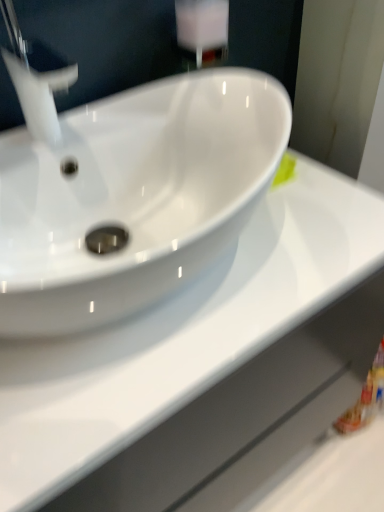
Question: Is white glossy faucet at upper left facing away from white glossy counter top at center?

Choices:
 (A) yes
 (B) no

Answer: (B)

Question: Is the position of white glossy faucet at upper left more distant than that of white glossy counter top at center?

Choices:
 (A) no
 (B) yes

Answer: (B)

Question: Does white glossy faucet at upper left appear on the left side of white glossy counter top at center?

Choices:
 (A) yes
 (B) no

Answer: (A)

Question: Is white glossy faucet at upper left oriented towards white glossy counter top at center?

Choices:
 (A) yes
 (B) no

Answer: (B)

Question: Is white glossy faucet at upper left positioned in front of white glossy counter top at center?

Choices:
 (A) yes
 (B) no

Answer: (B)

Question: Is white glossy faucet at upper left positioned far away from white glossy counter top at center?

Choices:
 (A) yes
 (B) no

Answer: (B)

Question: Considering the relative positions of white glossy counter top at center and white glossy faucet at upper left in the image provided, is white glossy counter top at center behind white glossy faucet at upper left?

Choices:
 (A) no
 (B) yes

Answer: (A)

Question: Is white glossy counter top at center oriented towards white glossy faucet at upper left?

Choices:
 (A) yes
 (B) no

Answer: (B)

Question: Is white glossy counter top at center at the right side of white glossy faucet at upper left?

Choices:
 (A) yes
 (B) no

Answer: (A)

Question: Is white glossy counter top at center wider than white glossy faucet at upper left?

Choices:
 (A) yes
 (B) no

Answer: (A)

Question: Can you confirm if white glossy counter top at center is bigger than white glossy faucet at upper left?

Choices:
 (A) no
 (B) yes

Answer: (B)

Question: From a real-world perspective, is white glossy counter top at center positioned under white glossy faucet at upper left based on gravity?

Choices:
 (A) no
 (B) yes

Answer: (B)

Question: Is white glossy faucet at upper left in front of or behind white glossy counter top at center in the image?

Choices:
 (A) front
 (B) behind

Answer: (B)